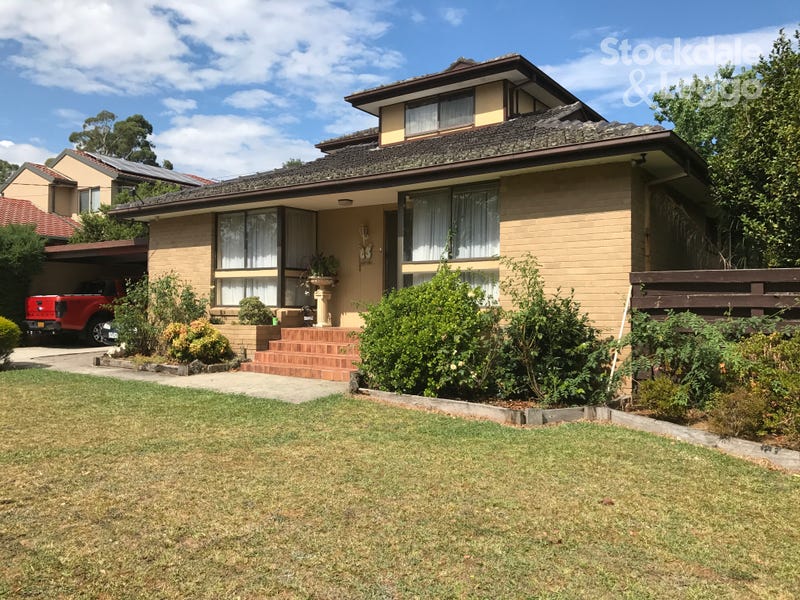
Where is `staircase`? The height and width of the screenshot is (600, 800). staircase is located at coordinates (349, 347).